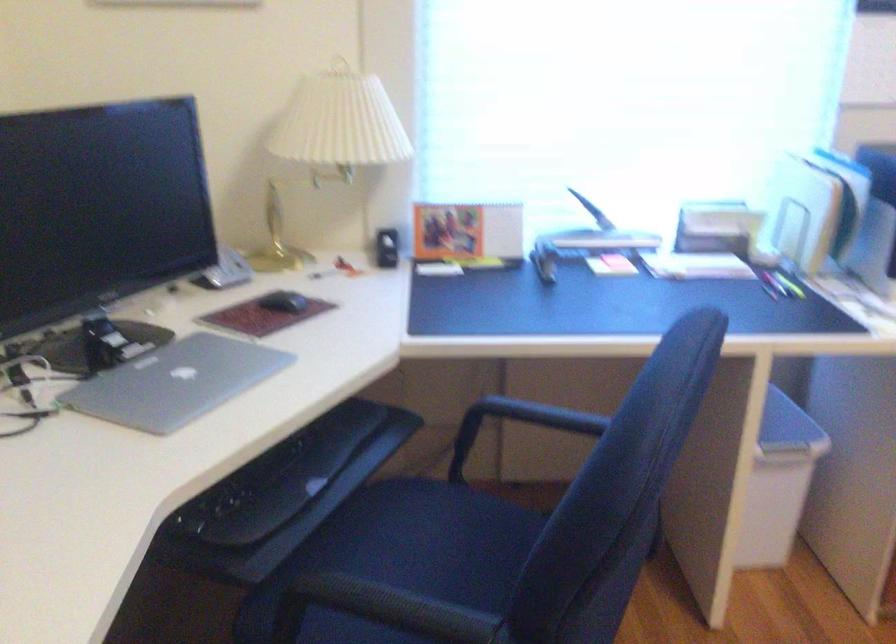
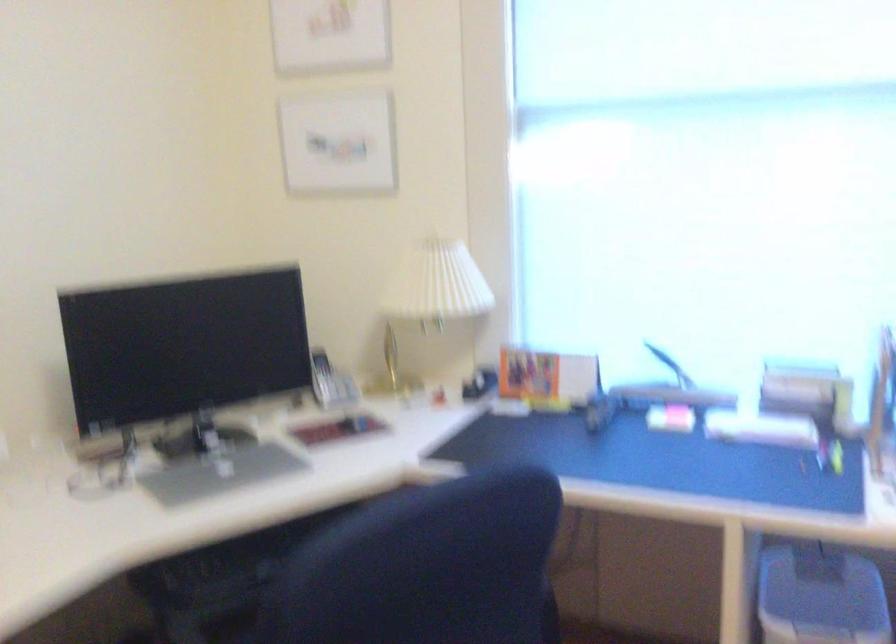
Find the pixel in the second image that matches (385,245) in the first image.

(479, 383)